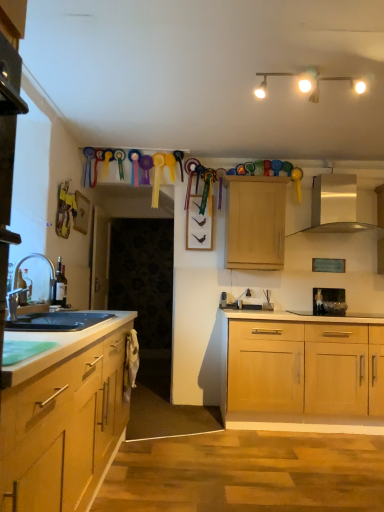
Question: Should I look upward or downward to see black glass gas stove at center?

Choices:
 (A) up
 (B) down

Answer: (B)

Question: From a real-world perspective, is silver metallic faucet at left under white matte track lights at upper center?

Choices:
 (A) yes
 (B) no

Answer: (A)

Question: Does silver metallic faucet at left have a smaller size compared to white matte track lights at upper center?

Choices:
 (A) no
 (B) yes

Answer: (B)

Question: Is silver metallic faucet at left far away from white matte track lights at upper center?

Choices:
 (A) yes
 (B) no

Answer: (A)

Question: Is silver metallic faucet at left facing towards white matte track lights at upper center?

Choices:
 (A) yes
 (B) no

Answer: (B)

Question: Can you confirm if silver metallic faucet at left is shorter than white matte track lights at upper center?

Choices:
 (A) yes
 (B) no

Answer: (B)

Question: Is silver metallic faucet at left taller than white matte track lights at upper center?

Choices:
 (A) yes
 (B) no

Answer: (A)

Question: Is black glass gas stove at center outside black granite countertop at lower left?

Choices:
 (A) yes
 (B) no

Answer: (A)

Question: From a real-world perspective, is black glass gas stove at center on top of black granite countertop at lower left?

Choices:
 (A) yes
 (B) no

Answer: (A)

Question: Is black glass gas stove at center aimed at black granite countertop at lower left?

Choices:
 (A) no
 (B) yes

Answer: (A)

Question: From the image's perspective, is black glass gas stove at center beneath black granite countertop at lower left?

Choices:
 (A) yes
 (B) no

Answer: (A)

Question: Considering the relative positions of black glass gas stove at center and black granite countertop at lower left in the image provided, is black glass gas stove at center to the right of black granite countertop at lower left from the viewer's perspective?

Choices:
 (A) yes
 (B) no

Answer: (A)

Question: Is black glass gas stove at center thinner than black granite countertop at lower left?

Choices:
 (A) yes
 (B) no

Answer: (B)

Question: Does black glass gas stove at center turn towards light wood cabinet at upper center?

Choices:
 (A) no
 (B) yes

Answer: (A)